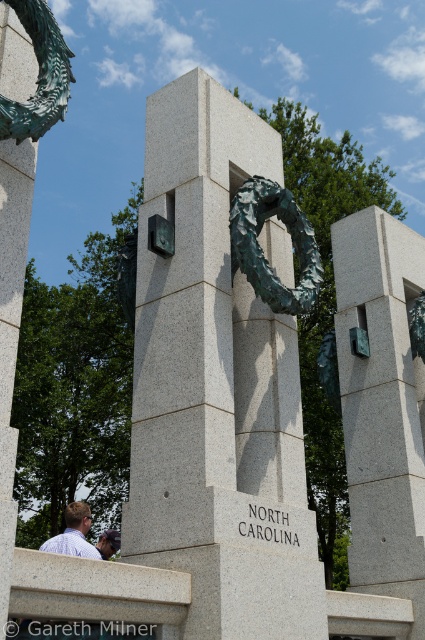
Question: Is gray granite column at center smaller than green patina wreath at center?

Choices:
 (A) no
 (B) yes

Answer: (A)

Question: Can you confirm if bronze textured wreath at center is smaller than matte gray stone at center?

Choices:
 (A) yes
 (B) no

Answer: (A)

Question: Which point appears closest to the camera in this image?

Choices:
 (A) (397, 227)
 (B) (178, 314)

Answer: (B)

Question: Which point is closer to the camera taking this photo?

Choices:
 (A) (71, 516)
 (B) (257, 243)
 (C) (189, 131)

Answer: (B)

Question: Which point is farther to the camera?

Choices:
 (A) bronze textured wreath at center
 (B) matte gray stone at center
 (C) gray granite column at center
 (D) green patina wreath at center

Answer: (D)

Question: Can you confirm if bronze textured wreath at center is smaller than gray granite column at center?

Choices:
 (A) no
 (B) yes

Answer: (A)